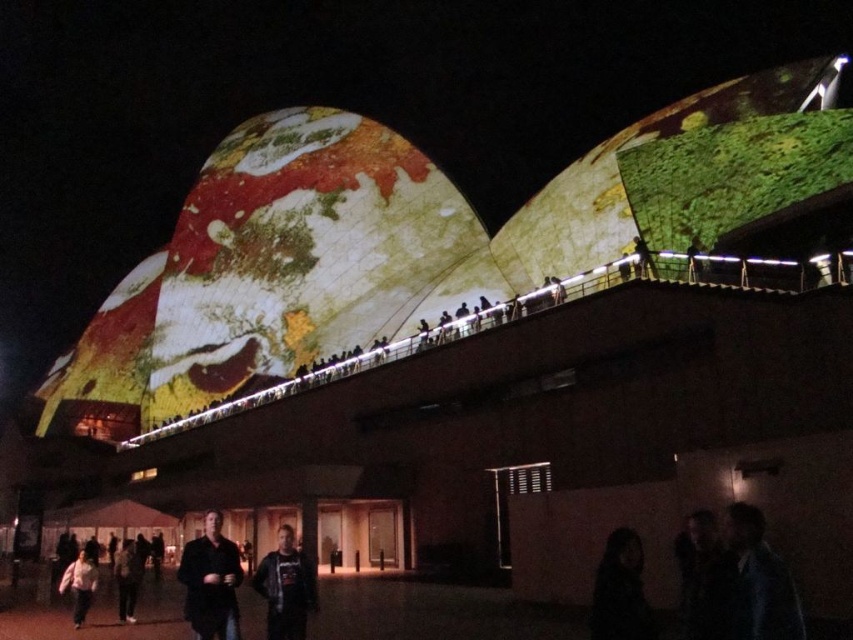
Looking at this image, you are a photographer at the event and want to capture a photo of the dark gray hoodie at center without the dark hair at lower center blocking it. What adjustment should you make to your camera position?

Move your camera position behind the dark gray hoodie at center so that the dark hair at lower center is no longer in front of it.

You are a security guard at the building and need to determine which of the two jackets, the dark brown leather jacket at lower center or the dark gray hoodie at center, is more likely to belong to a visitor who is taller than average. Based on their sizes, which jacket should you focus on?

The dark brown leather jacket at lower center has a larger size compared to the dark gray hoodie at center, so it is more likely to belong to a visitor who is taller than average.

You are organizing a night event at the iconic building with the two curved structures. You need to decide which attendee is closer to the projection on the building. The attendees are wearing a dark gray hoodie at center and a white matte shirt at lower left. Which attendee is positioned closer to the projection?

The white matte shirt at lower left is positioned closer to the projection because the dark gray hoodie at center is bigger, indicating it is farther away.